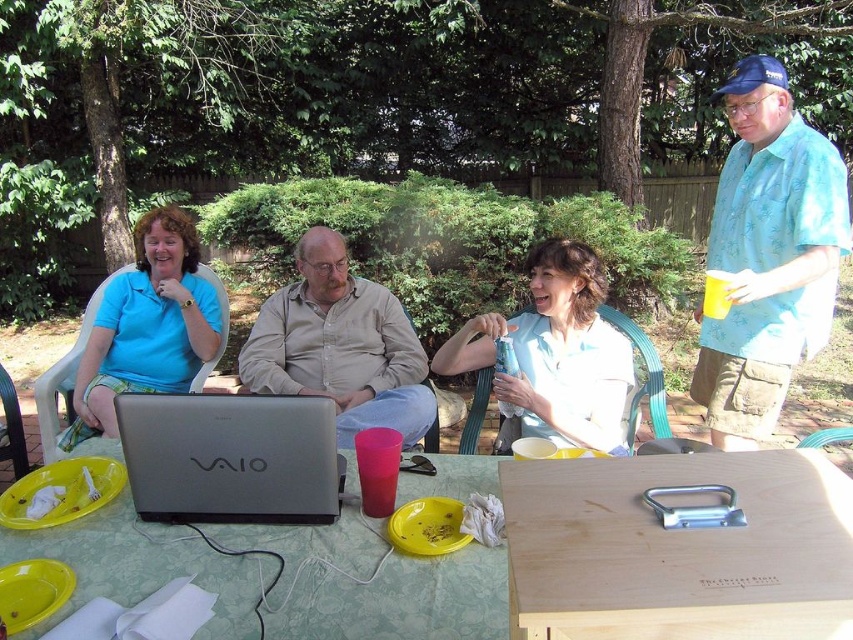
Question: Which point is farther to the camera?

Choices:
 (A) 294,515
 (B) 593,368
 (C) 502,605

Answer: (B)

Question: Which point is closer to the camera taking this photo?

Choices:
 (A) (642, 509)
 (B) (177, 225)

Answer: (A)

Question: Which point is closer to the camera?

Choices:
 (A) (112, 387)
 (B) (132, 500)
 (C) (770, 305)

Answer: (B)

Question: Can you confirm if blue floral shirt at upper right is positioned above light beige shirt at center?

Choices:
 (A) no
 (B) yes

Answer: (B)

Question: Can you confirm if wooden at center is positioned above white matte water bottle at center?

Choices:
 (A) no
 (B) yes

Answer: (A)

Question: Is light beige shirt at center bigger than matte blue shirt at center?

Choices:
 (A) no
 (B) yes

Answer: (B)